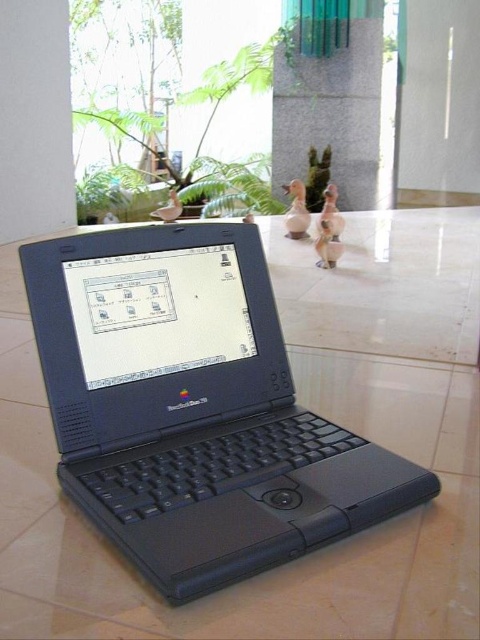
You are organizing a display for a toy store and need to place both the matte ceramic duck at center and the matte brown duck at center on a shelf. The shelf has limited space, and you want to ensure the larger duck is placed first. Which duck should you place on the shelf first?

The matte ceramic duck at center should be placed first because it is larger than the matte brown duck at center, ensuring there is enough space for it on the shelf.

You are standing in a room and see the black plastic laptop at center and the gray stone pillar at center. Which object is closer to you?

The black plastic laptop at center is closer to you because it is in front of the gray stone pillar at center.